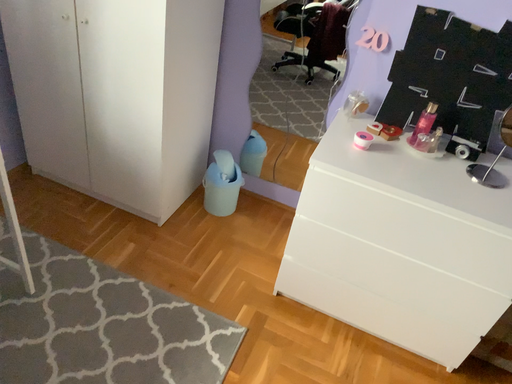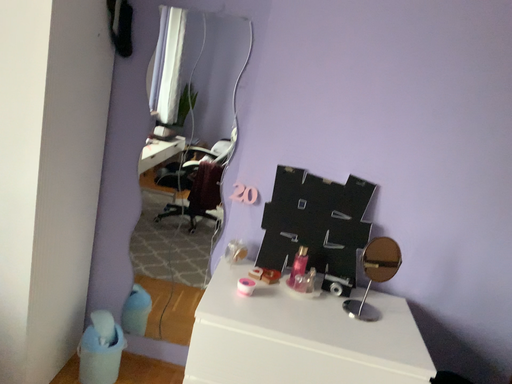
Question: How did the camera likely rotate when shooting the video?

Choices:
 (A) rotated downward
 (B) rotated upward

Answer: (B)